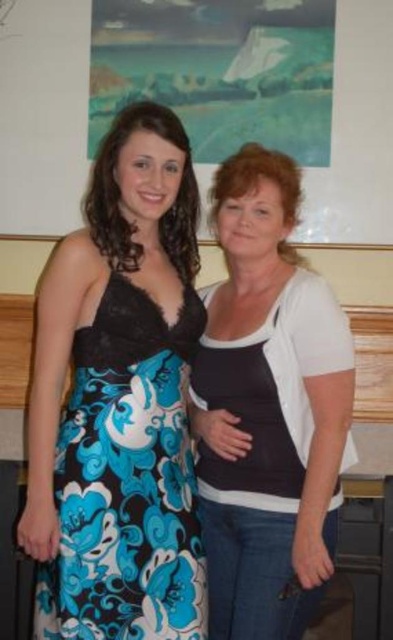
Question: Which object is farther from the camera taking this photo?

Choices:
 (A) floral-patterned fabric dress at center
 (B) white matte tank top at center

Answer: (B)

Question: Which object appears farthest from the camera in this image?

Choices:
 (A) white matte tank top at center
 (B) floral-patterned fabric dress at center

Answer: (A)

Question: Is white matte tank top at center to the right of floral-patterned fabric dress at center from the viewer's perspective?

Choices:
 (A) yes
 (B) no

Answer: (A)

Question: From the image, what is the correct spatial relationship of white matte tank top at center in relation to floral-patterned fabric dress at center?

Choices:
 (A) below
 (B) above

Answer: (B)

Question: Can you confirm if white matte tank top at center is positioned to the left of floral-patterned fabric dress at center?

Choices:
 (A) no
 (B) yes

Answer: (A)

Question: Which point is closer to the camera?

Choices:
 (A) white matte tank top at center
 (B) floral-patterned fabric dress at center

Answer: (B)